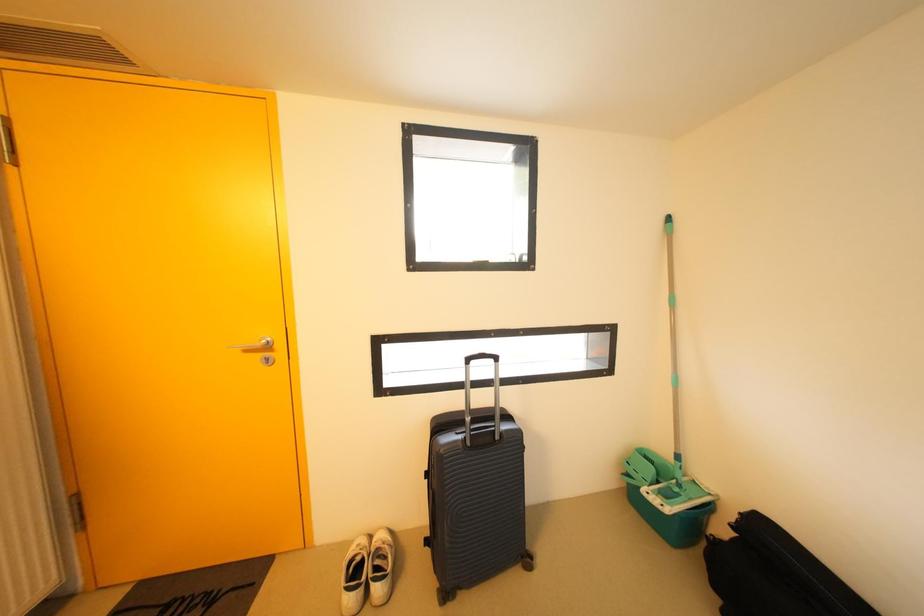
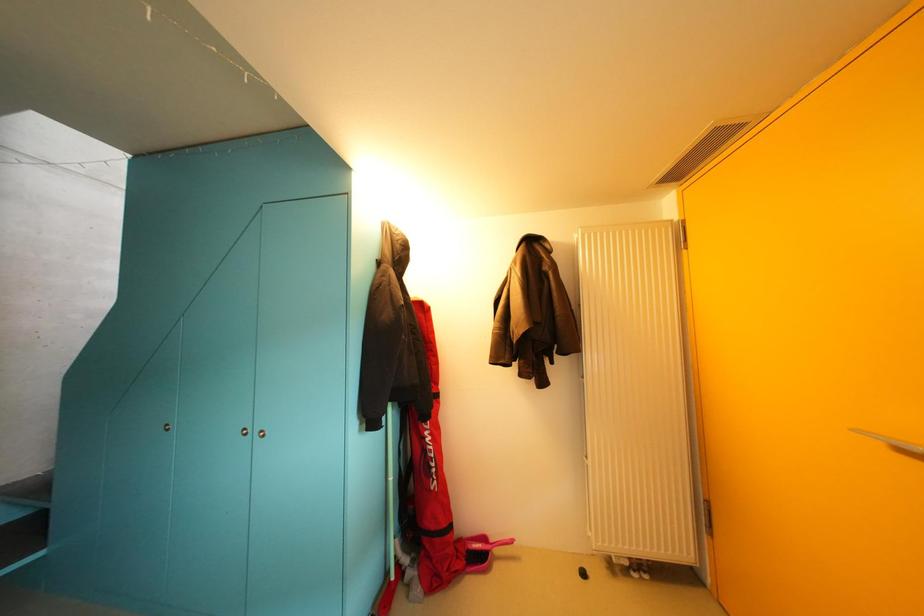
Question: The camera is either moving clockwise (left) or counter-clockwise (right) around the object. The first image is from the beginning of the video and the second image is from the end. Is the camera moving left or right when shooting the video?

Choices:
 (A) Left
 (B) Right

Answer: (B)